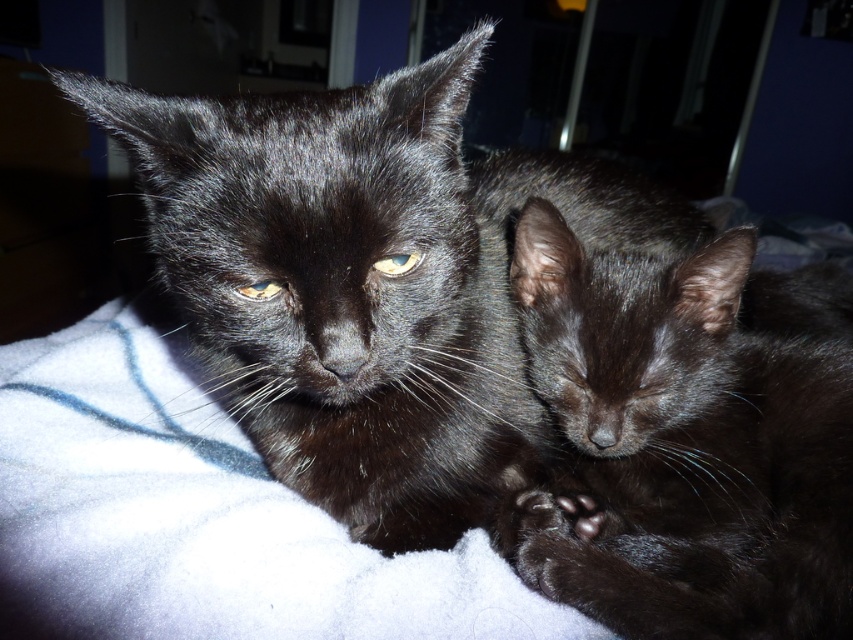
Question: Is shiny black cat at center to the right of shiny black kitten at center from the viewer's perspective?

Choices:
 (A) no
 (B) yes

Answer: (A)

Question: Which of these objects is positioned farthest from the matte black eye at center?

Choices:
 (A) shiny black cat at center
 (B) shiny black kitten at center

Answer: (B)

Question: Which point appears closest to the camera in this image?

Choices:
 (A) (763, 394)
 (B) (399, 272)

Answer: (B)

Question: Which of the following is the closest to the observer?

Choices:
 (A) (393, 262)
 (B) (245, 291)

Answer: (B)

Question: Is matte black eye at center above matte yellow eye at upper left?

Choices:
 (A) yes
 (B) no

Answer: (A)

Question: Observing the image, what is the correct spatial positioning of shiny black kitten at center in reference to matte yellow eye at upper left?

Choices:
 (A) right
 (B) left

Answer: (A)